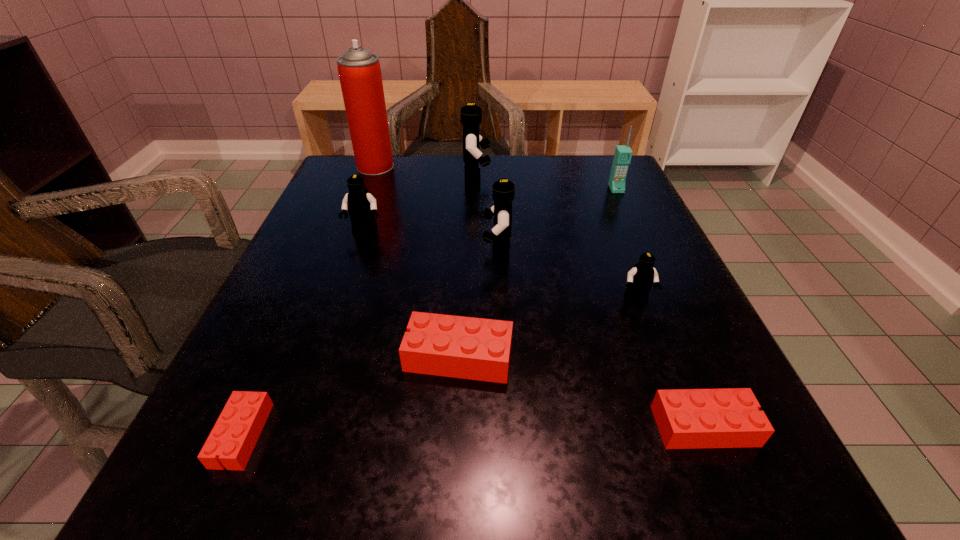
The height and width of the screenshot is (540, 960). Identify the location of aerosol can present at the left edge. (359, 71).

Where is `cellular telephone positioned at the right edge`? cellular telephone positioned at the right edge is located at coordinates (622, 157).

Where is `object that is at the far left corner`? The width and height of the screenshot is (960, 540). object that is at the far left corner is located at coordinates (359, 71).

This screenshot has height=540, width=960. I want to click on object present at the near left corner, so click(234, 436).

Image resolution: width=960 pixels, height=540 pixels. In order to click on object situated at the far right corner in this screenshot , I will do `click(622, 157)`.

At what (x,y) coordinates should I click in order to perform the action: click on object positioned at the near right corner. Please return your answer as a coordinate pair (x, y). Looking at the image, I should click on (686, 418).

Identify the location of vacant space at the far edge of the desktop. (528, 163).

The image size is (960, 540). Identify the location of free region at the near edge. (464, 448).

The image size is (960, 540). Identify the location of free space at the left edge of the desktop. (293, 312).

Identify the location of vacant point at the right edge. This screenshot has width=960, height=540. (585, 240).